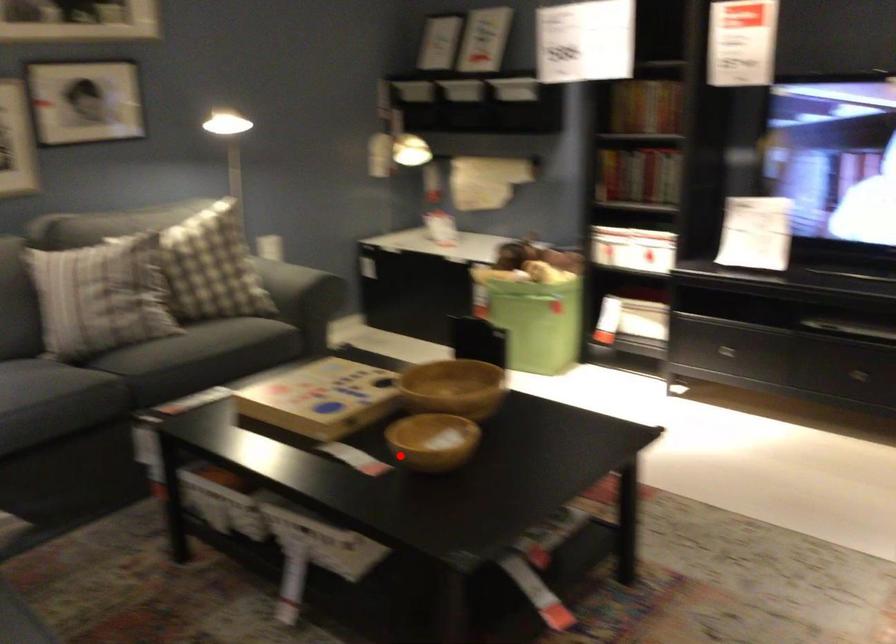
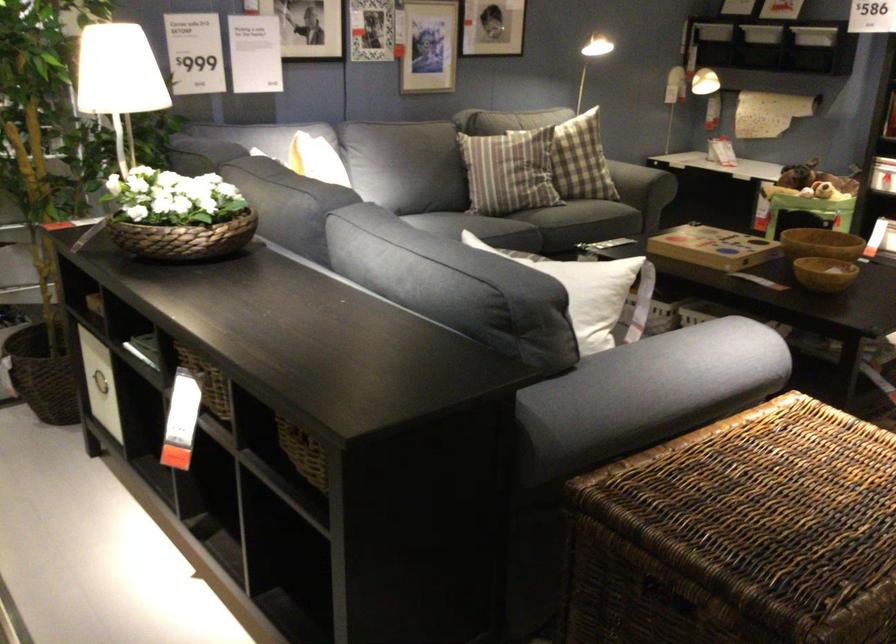
Question: I am providing you with two images of the same scene from different viewpoints. In image1, a red point is highlighted. Considering the same 3D point in image2, which of the following is correct?

Choices:
 (A) It is closer
 (B) It is farther

Answer: (B)